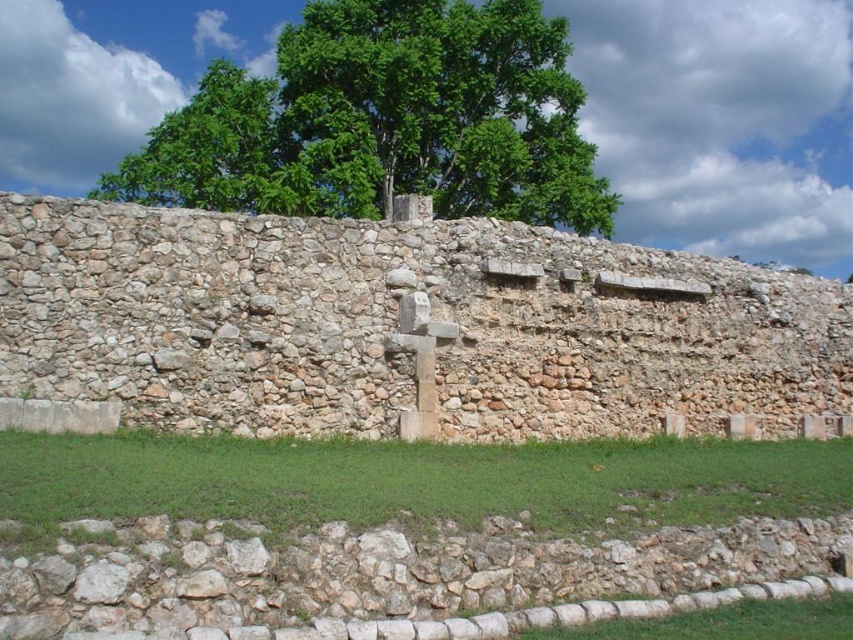
Question: Observing the image, what is the correct spatial positioning of green leafy tree at upper center in reference to smooth stone cross at center?

Choices:
 (A) above
 (B) below

Answer: (A)

Question: Is rustic stone wall at center to the left of smooth stone cross at center from the viewer's perspective?

Choices:
 (A) yes
 (B) no

Answer: (B)

Question: In this image, where is rustic stone wall at center located relative to smooth stone cross at center?

Choices:
 (A) below
 (B) above

Answer: (B)

Question: Which point is farther to the camera?

Choices:
 (A) green leafy tree at upper center
 (B) rustic stone wall at center
 (C) smooth stone cross at center

Answer: (A)

Question: Based on their relative distances, which object is nearer to the smooth stone cross at center?

Choices:
 (A) green leafy tree at upper center
 (B) rustic stone wall at center

Answer: (B)

Question: Which of the following is the closest to the observer?

Choices:
 (A) (49, 301)
 (B) (363, 154)
 (C) (405, 292)

Answer: (A)